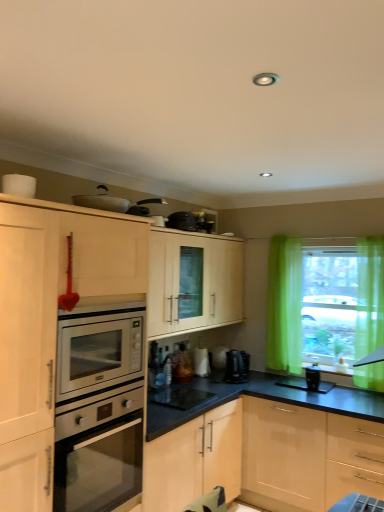
Question: From a real-world perspective, is translucent glass window sill at lower right located beneath silver metallic oven at left?

Choices:
 (A) yes
 (B) no

Answer: (B)

Question: Is translucent glass window sill at lower right smaller than silver metallic oven at left?

Choices:
 (A) no
 (B) yes

Answer: (B)

Question: Does translucent glass window sill at lower right turn towards silver metallic oven at left?

Choices:
 (A) yes
 (B) no

Answer: (B)

Question: Is translucent glass window sill at lower right outside of silver metallic oven at left?

Choices:
 (A) no
 (B) yes

Answer: (B)

Question: Would you say translucent glass window sill at lower right contains silver metallic oven at left?

Choices:
 (A) yes
 (B) no

Answer: (B)

Question: Is point (145, 209) closer or farther from the camera than point (354, 376)?

Choices:
 (A) closer
 (B) farther

Answer: (A)

Question: Looking at their shapes, would you say metallic silver pan at upper center, the first appliance from the front, is wider or thinner than green sheer curtain at right?

Choices:
 (A) wide
 (B) thin

Answer: (A)

Question: In terms of height, does metallic silver pan at upper center, marked as the third appliance in a bottom-to-top arrangement, look taller or shorter compared to green sheer curtain at right?

Choices:
 (A) tall
 (B) short

Answer: (B)

Question: Is metallic silver pan at upper center, the first appliance from the front, inside or outside of green sheer curtain at right?

Choices:
 (A) outside
 (B) inside

Answer: (A)

Question: Considering the positions of black plastic canister at lower right, arranged as the 2th appliance when ordered from the bottom, and silver metallic oven at left in the image, is black plastic canister at lower right, arranged as the 2th appliance when ordered from the bottom, wider or thinner than silver metallic oven at left?

Choices:
 (A) wide
 (B) thin

Answer: (B)

Question: Does point (307, 376) appear closer or farther from the camera than point (117, 442)?

Choices:
 (A) farther
 (B) closer

Answer: (A)

Question: Based on their positions, is black plastic canister at lower right, acting as the 2th appliance starting from the top, located to the left or right of silver metallic oven at left?

Choices:
 (A) left
 (B) right

Answer: (B)

Question: From the image's perspective, is black plastic canister at lower right, placed as the 3th appliance when sorted from left to right, positioned above or below silver metallic oven at left?

Choices:
 (A) below
 (B) above

Answer: (B)

Question: Looking at their shapes, would you say translucent glass window sill at lower right is wider or thinner than metallic silver pan at upper center, marked as the third appliance in a bottom-to-top arrangement?

Choices:
 (A) thin
 (B) wide

Answer: (A)

Question: From a real-world perspective, is translucent glass window sill at lower right positioned above or below metallic silver pan at upper center, which is the 1th appliance from left to right?

Choices:
 (A) below
 (B) above

Answer: (A)